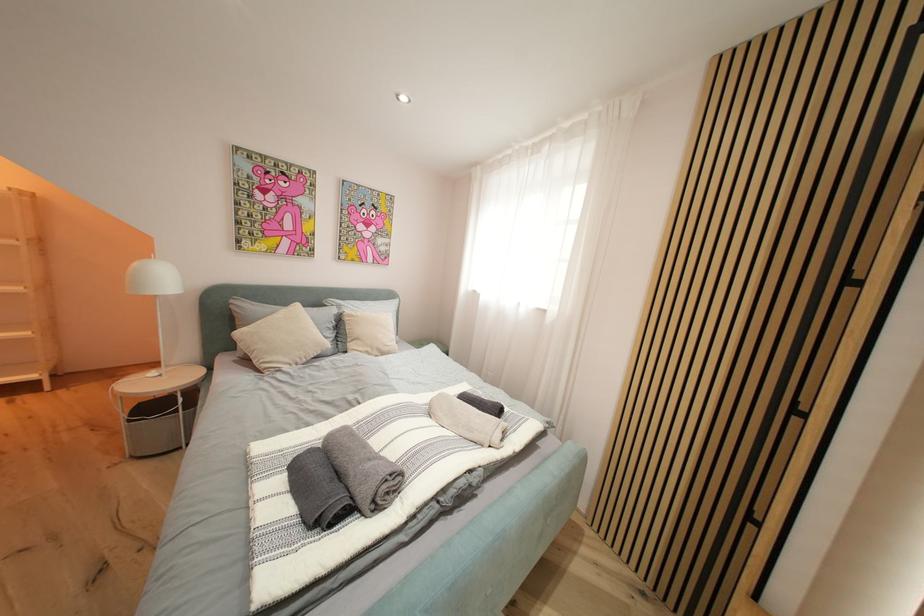
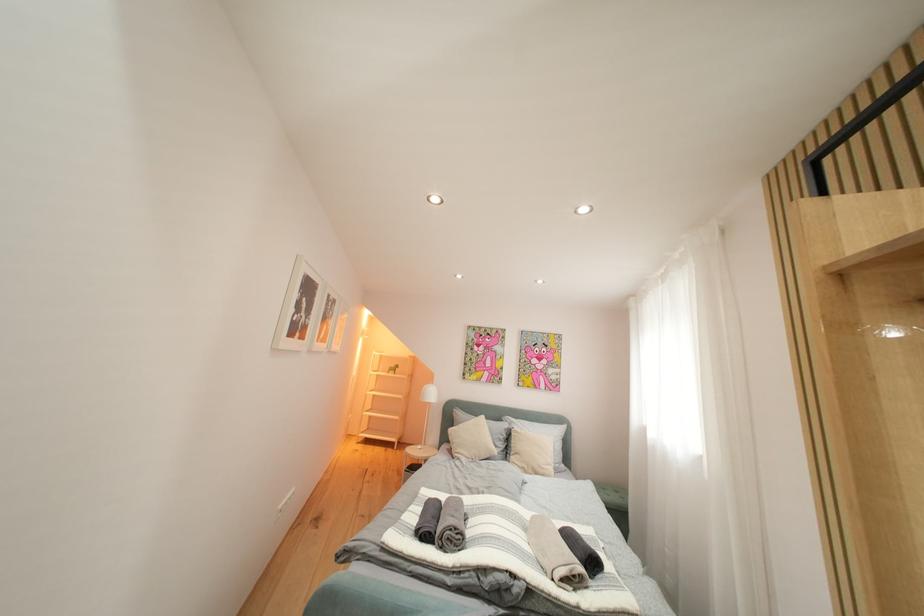
Based on the continuous images, in which direction is the camera rotating?

The camera rotated toward left-up.